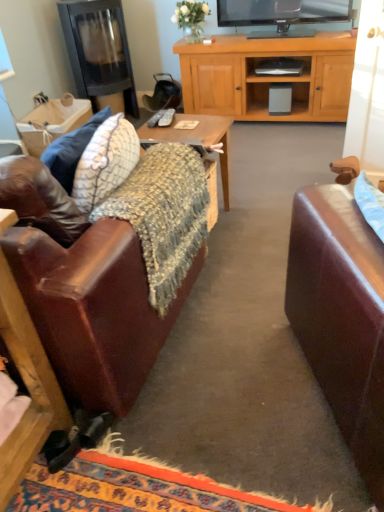
What is the approximate height of knitted woolen blanket at center?

knitted woolen blanket at center is 18.65 inches in height.

What do you see at coordinates (155, 119) in the screenshot? The image size is (384, 512). I see `white matte remote control at center, positioned as the 1th remote control in left-to-right order` at bounding box center [155, 119].

How much space does matte gray remote control at center, marked as the 2th remote control in a left-to-right arrangement, occupy horizontally?

The width of matte gray remote control at center, marked as the 2th remote control in a left-to-right arrangement, is 8.09 inches.

What do you see at coordinates (99, 51) in the screenshot? The width and height of the screenshot is (384, 512). I see `black glass fireplace at upper left` at bounding box center [99, 51].

Describe the element at coordinates (52, 123) in the screenshot. The width and height of the screenshot is (384, 512). I see `natural woven picnic basket at upper left` at that location.

Where is `natural woven picnic basket at upper left`? natural woven picnic basket at upper left is located at coordinates (52, 123).

Measure the distance between point (187, 172) and camera.

They are 1.66 meters apart.

Where is `knitted fabric desk at center`? knitted fabric desk at center is located at coordinates (199, 139).

Identify the location of knitted woolen blanket at center. The image size is (384, 512). (163, 215).

Can you tell me how much leather couch at left and black glass fireplace at upper left differ in facing direction?

180 degrees separate the facing orientations of leather couch at left and black glass fireplace at upper left.

Is point (75, 374) closer or farther from the camera than point (133, 109)?

Point (75, 374) is positioned closer to the camera compared to point (133, 109).

Are leather couch at left and black glass fireplace at upper left located far from each other?

Absolutely, leather couch at left is distant from black glass fireplace at upper left.

From a real-world perspective, is leather couch at left below black glass fireplace at upper left?

Yes, from a real-world perspective, leather couch at left is beneath black glass fireplace at upper left.

Does point (152, 131) appear closer or farther from the camera than point (81, 68)?

Point (152, 131).

Looking at this image, which of these two, knitted fabric desk at center or black glass fireplace at upper left, stands taller?

black glass fireplace at upper left is taller.

Which object is more forward, knitted fabric desk at center or black glass fireplace at upper left?

knitted fabric desk at center is closer to the camera.

Is leather couch at left not near knitted fabric desk at center?

No, leather couch at left is not far from knitted fabric desk at center.

Considering the sizes of objects leather couch at left and knitted fabric desk at center in the image provided, who is smaller, leather couch at left or knitted fabric desk at center?

knitted fabric desk at center is smaller.

Is leather couch at left facing towards knitted fabric desk at center?

Yes, leather couch at left is oriented towards knitted fabric desk at center.

Based on the photo, does leather couch at left have a greater width compared to knitted fabric desk at center?

Yes.

Is knitted fabric desk at center not within leather couch at left?

Actually, knitted fabric desk at center is at least partially inside leather couch at left.

From a real-world perspective, is knitted fabric desk at center positioned above or below leather couch at left?

knitted fabric desk at center is above leather couch at left.

Considering the relative positions of knitted fabric desk at center and leather couch at left in the image provided, is knitted fabric desk at center to the left or to the right of leather couch at left?

From the image, it's evident that knitted fabric desk at center is to the right of leather couch at left.

Is knitted fabric desk at center shorter than leather couch at left?

Correct, knitted fabric desk at center is not as tall as leather couch at left.

Would you consider matte gray remote control at center, marked as the first remote control in a right-to-left arrangement, to be distant from natural woven picnic basket at upper left?

Yes, matte gray remote control at center, marked as the first remote control in a right-to-left arrangement, is far from natural woven picnic basket at upper left.

From the image's perspective, is matte gray remote control at center, marked as the 2th remote control in a left-to-right arrangement, above natural woven picnic basket at upper left?

No, from the image's perspective, matte gray remote control at center, marked as the 2th remote control in a left-to-right arrangement, is not over natural woven picnic basket at upper left.

Considering the relative sizes of matte gray remote control at center, marked as the 2th remote control in a left-to-right arrangement, and natural woven picnic basket at upper left in the image provided, is matte gray remote control at center, marked as the 2th remote control in a left-to-right arrangement, thinner than natural woven picnic basket at upper left?

Yes, matte gray remote control at center, marked as the 2th remote control in a left-to-right arrangement, is thinner than natural woven picnic basket at upper left.

Is matte gray remote control at center, marked as the first remote control in a right-to-left arrangement, not within natural woven picnic basket at upper left?

Yes, matte gray remote control at center, marked as the first remote control in a right-to-left arrangement, is outside of natural woven picnic basket at upper left.

How different are the orientations of matte gray remote control at center, marked as the 2th remote control in a left-to-right arrangement, and knitted woolen blanket at center in degrees?

11.7 degrees.

Who is bigger, matte gray remote control at center, marked as the first remote control in a right-to-left arrangement, or knitted woolen blanket at center?

knitted woolen blanket at center.

Considering the relative sizes of matte gray remote control at center, marked as the first remote control in a right-to-left arrangement, and knitted woolen blanket at center in the image provided, is matte gray remote control at center, marked as the first remote control in a right-to-left arrangement, taller than knitted woolen blanket at center?

No.

Considering the positions of objects matte gray remote control at center, marked as the first remote control in a right-to-left arrangement, and knitted woolen blanket at center in the image provided, who is in front, matte gray remote control at center, marked as the first remote control in a right-to-left arrangement, or knitted woolen blanket at center?

knitted woolen blanket at center.

From their relative heights in the image, would you say natural woven picnic basket at upper left is taller or shorter than white matte remote control at center, positioned as the 1th remote control in left-to-right order?

In the image, natural woven picnic basket at upper left appears to be taller than white matte remote control at center, positioned as the 1th remote control in left-to-right order.

Is natural woven picnic basket at upper left touching white matte remote control at center, positioned as the 1th remote control in left-to-right order?

No, natural woven picnic basket at upper left is not touching white matte remote control at center, positioned as the 1th remote control in left-to-right order.

What's the angular difference between natural woven picnic basket at upper left and white matte remote control at center, acting as the 2th remote control starting from the right,'s facing directions?

The angular difference between natural woven picnic basket at upper left and white matte remote control at center, acting as the 2th remote control starting from the right, is 90 degrees.

You are a GUI agent. You are given a task and a screenshot of the screen. Output one action in this format:
    pyautogui.click(x=<x>, y=<y>)
    Task: Click on the fireplace on the left side of leather couch at left
    The image size is (384, 512).
    Given the screenshot: What is the action you would take?
    pyautogui.click(x=99, y=51)

Locate an element on the screen. The height and width of the screenshot is (512, 384). desk above the black glass fireplace at upper left (from a real-world perspective) is located at coordinates (199, 139).

From the image, which object appears to be farther from white matte remote control at center, acting as the 2th remote control starting from the right, black glass fireplace at upper left or matte gray remote control at center, marked as the first remote control in a right-to-left arrangement?

black glass fireplace at upper left is further to white matte remote control at center, acting as the 2th remote control starting from the right.

From the image, which object appears to be nearer to black glass fireplace at upper left, natural woven picnic basket at upper left or knitted fabric desk at center?

The object closer to black glass fireplace at upper left is natural woven picnic basket at upper left.

Which object lies further to the anchor point knitted fabric desk at center, matte gray remote control at center, marked as the first remote control in a right-to-left arrangement, or knitted woolen blanket at center?

Based on the image, knitted woolen blanket at center appears to be further to knitted fabric desk at center.

Estimate the real-world distances between objects in this image. Which object is closer to knitted fabric desk at center, natural woven picnic basket at upper left or black glass fireplace at upper left?

Based on the image, natural woven picnic basket at upper left appears to be nearer to knitted fabric desk at center.

Estimate the real-world distances between objects in this image. Which object is further from black glass fireplace at upper left, knitted woolen blanket at center or leather couch at left?

The object further to black glass fireplace at upper left is leather couch at left.

Estimate the real-world distances between objects in this image. Which object is closer to leather couch at left, black glass fireplace at upper left or knitted fabric desk at center?

Based on the image, knitted fabric desk at center appears to be nearer to leather couch at left.

Based on their spatial positions, is matte gray remote control at center, marked as the first remote control in a right-to-left arrangement, or natural woven picnic basket at upper left closer to white matte remote control at center, positioned as the 1th remote control in left-to-right order?

matte gray remote control at center, marked as the first remote control in a right-to-left arrangement, is positioned closer to the anchor white matte remote control at center, positioned as the 1th remote control in left-to-right order.

When comparing their distances from matte gray remote control at center, marked as the first remote control in a right-to-left arrangement, does natural woven picnic basket at upper left or black glass fireplace at upper left seem closer?

natural woven picnic basket at upper left lies closer to matte gray remote control at center, marked as the first remote control in a right-to-left arrangement, than the other object.

The height and width of the screenshot is (512, 384). I want to click on remote control located between natural woven picnic basket at upper left and matte gray remote control at center, marked as the first remote control in a right-to-left arrangement, in the left-right direction, so click(155, 119).

Identify the location of blanket between leather couch at left and black glass fireplace at upper left in the front-back direction. (163, 215).

The image size is (384, 512). Find the location of `picnic basket between white matte remote control at center, acting as the 2th remote control starting from the right, and black glass fireplace at upper left, along the z-axis`. picnic basket between white matte remote control at center, acting as the 2th remote control starting from the right, and black glass fireplace at upper left, along the z-axis is located at coordinates (52, 123).

I want to click on desk positioned between leather couch at left and white matte remote control at center, acting as the 2th remote control starting from the right, from near to far, so click(x=199, y=139).